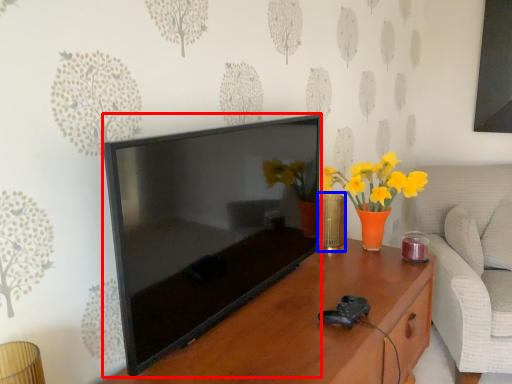
Question: Among these objects, which one is farthest to the camera, television (highlighted by a red box) or vase (highlighted by a blue box)?

Choices:
 (A) television
 (B) vase

Answer: (B)